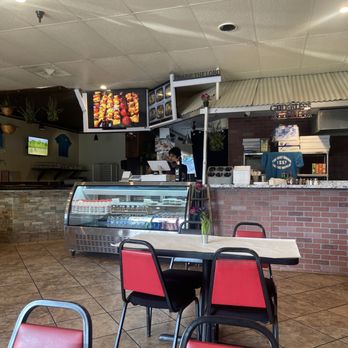
Image resolution: width=348 pixels, height=348 pixels. Find the location of `refrigerator for cold drinks`. refrigerator for cold drinks is located at coordinates (99, 227).